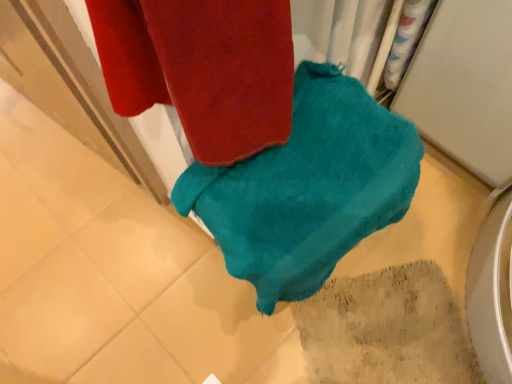
Question: Based on their sizes in the image, would you say teal soft towel at center is bigger or smaller than textured beige rug at lower right?

Choices:
 (A) big
 (B) small

Answer: (A)

Question: In terms of width, does teal soft towel at center look wider or thinner when compared to textured beige rug at lower right?

Choices:
 (A) thin
 (B) wide

Answer: (A)

Question: From the image's perspective, is teal soft towel at center above or below textured beige rug at lower right?

Choices:
 (A) above
 (B) below

Answer: (A)

Question: In the image, is textured beige rug at lower right positioned in front of or behind teal soft towel at center?

Choices:
 (A) behind
 (B) front

Answer: (A)

Question: Considering the positions of point (392, 289) and point (395, 205), is point (392, 289) closer or farther from the camera than point (395, 205)?

Choices:
 (A) farther
 (B) closer

Answer: (A)

Question: Based on their sizes in the image, would you say textured beige rug at lower right is bigger or smaller than teal soft towel at center?

Choices:
 (A) big
 (B) small

Answer: (B)

Question: Considering the relative positions of textured beige rug at lower right and teal soft towel at center in the image provided, is textured beige rug at lower right to the left or to the right of teal soft towel at center?

Choices:
 (A) left
 (B) right

Answer: (B)